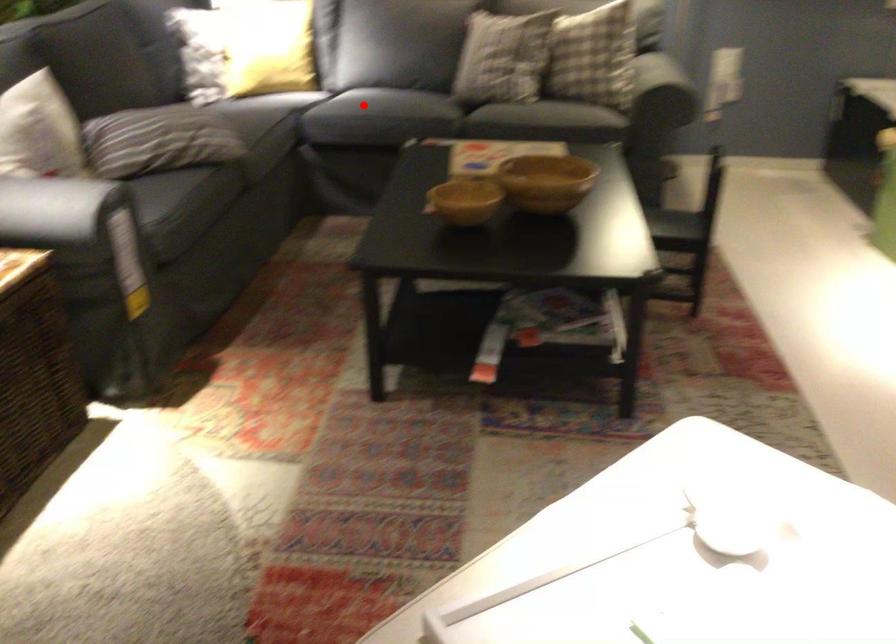
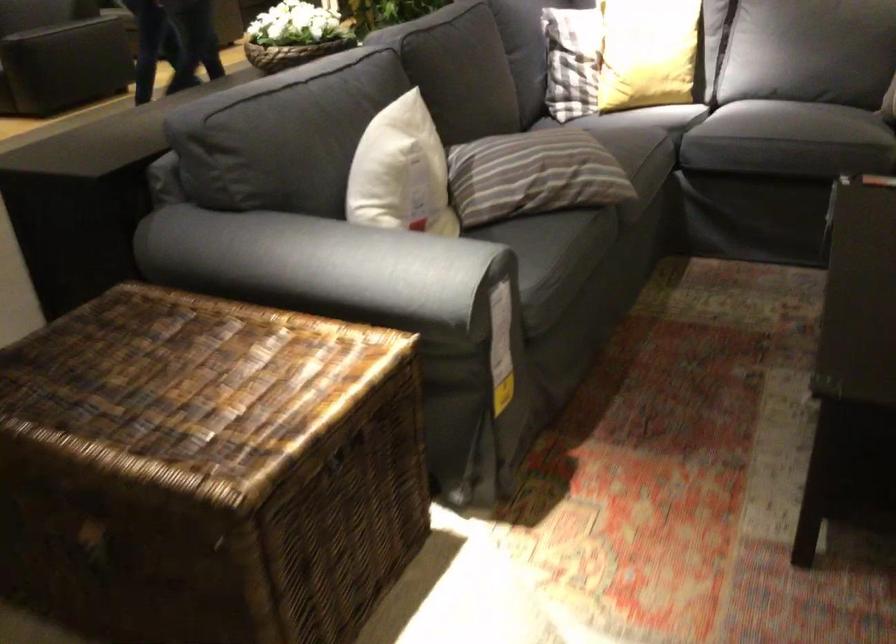
Question: I am providing you with two images of the same scene from different viewpoints. A red point is marked on the first image. Can you still see the location of the red point in image 2?

Choices:
 (A) Yes
 (B) No

Answer: (A)